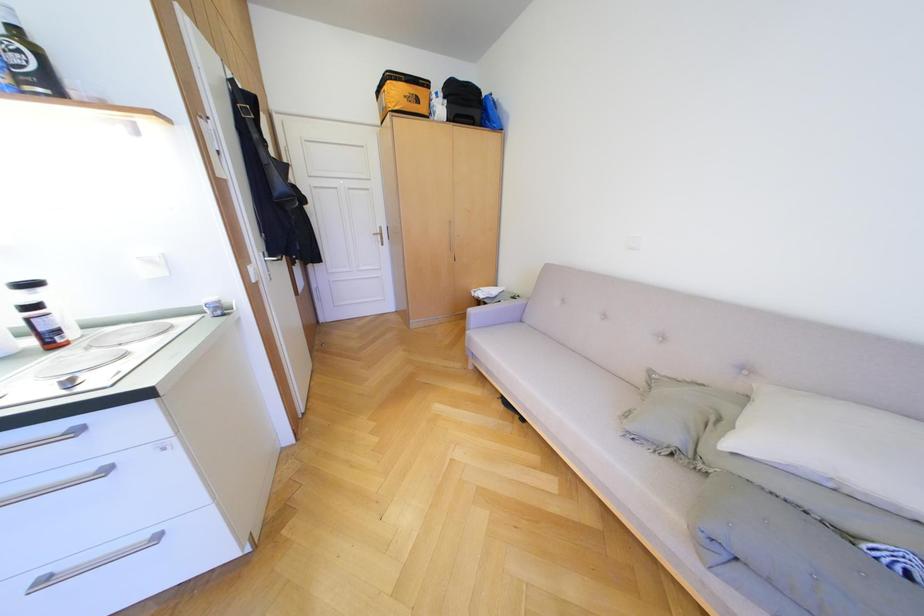
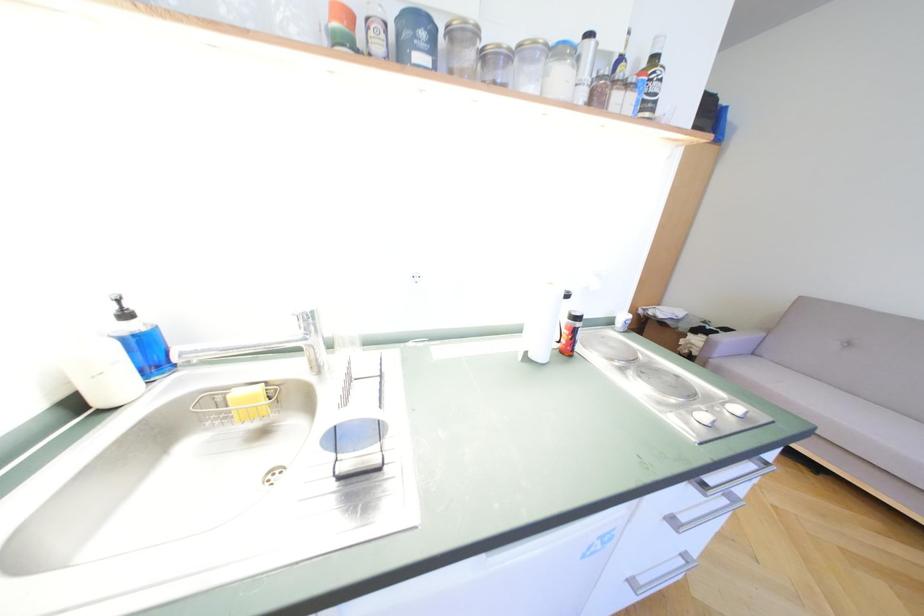
Question: The images are taken continuously from a first-person perspective. In which direction are you moving?

Choices:
 (A) Left
 (B) Right
 (C) Forward
 (D) Backward

Answer: (A)